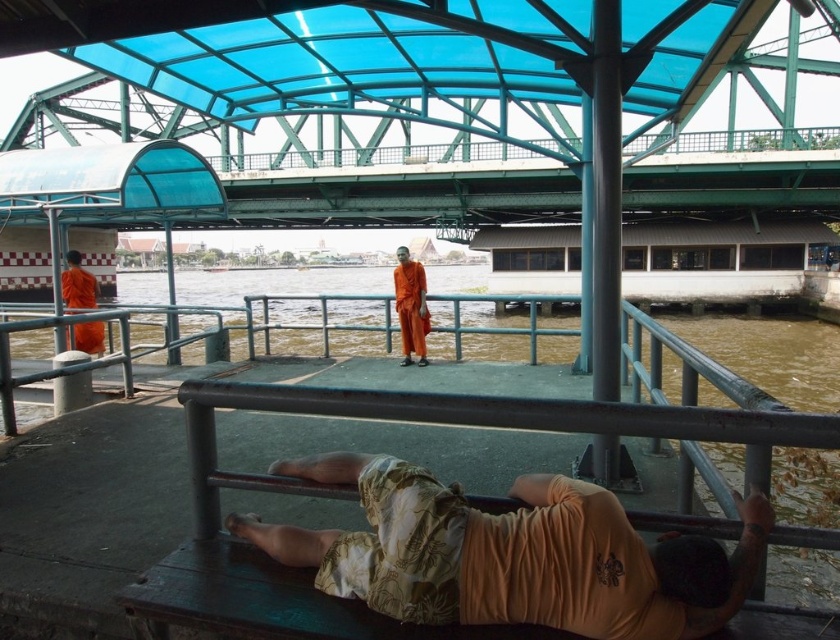
Question: In this image, where is hawaiian print fabric shirt at lower center located relative to orange cloth at center?

Choices:
 (A) right
 (B) left

Answer: (A)

Question: Can you confirm if orange cloth at center is smaller than orange cloth monk at left?

Choices:
 (A) yes
 (B) no

Answer: (A)

Question: Among these points, which one is nearest to the camera?

Choices:
 (A) (471, 588)
 (B) (319, 627)

Answer: (A)

Question: Can you confirm if metallic gray rail at center is smaller than orange cloth at center?

Choices:
 (A) no
 (B) yes

Answer: (A)

Question: Estimate the real-world distances between objects in this image. Which object is closer to the orange cloth monk at left?

Choices:
 (A) metallic gray rail at center
 (B) orange cloth at center

Answer: (B)

Question: Which of the following is the closest to the observer?

Choices:
 (A) orange cloth at center
 (B) metallic gray rail at center
 (C) orange cloth monk at left

Answer: (B)